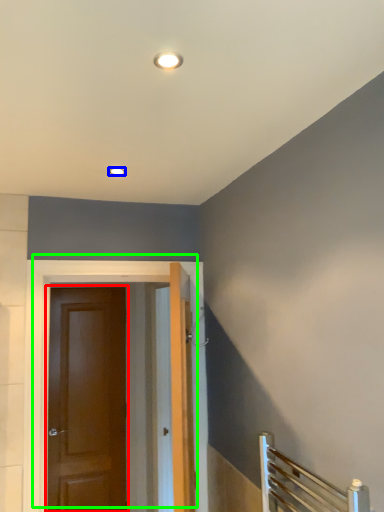
Question: Which object is the closest to the door (highlighted by a red box)? Choose among these: lighting (highlighted by a blue box) or door (highlighted by a green box).

Choices:
 (A) lighting
 (B) door

Answer: (B)